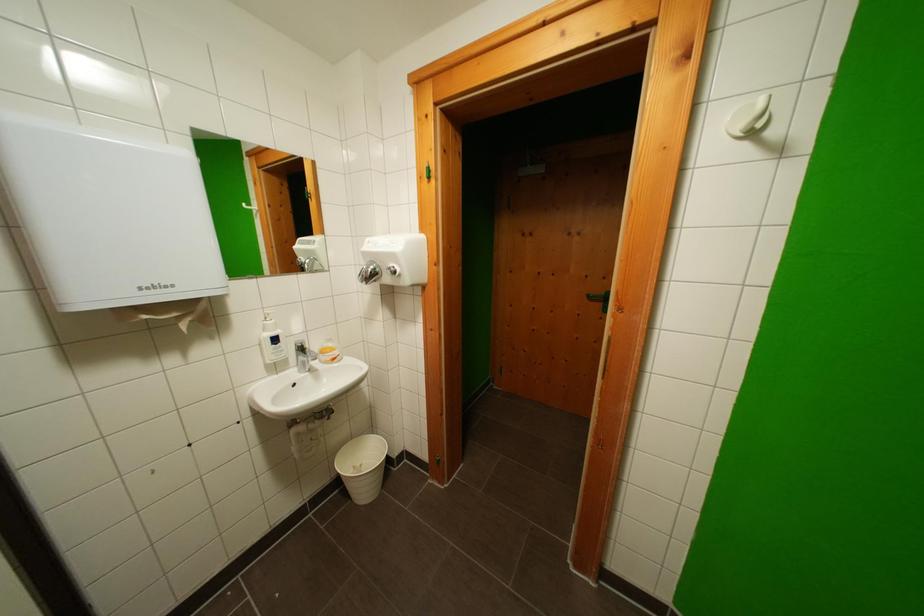
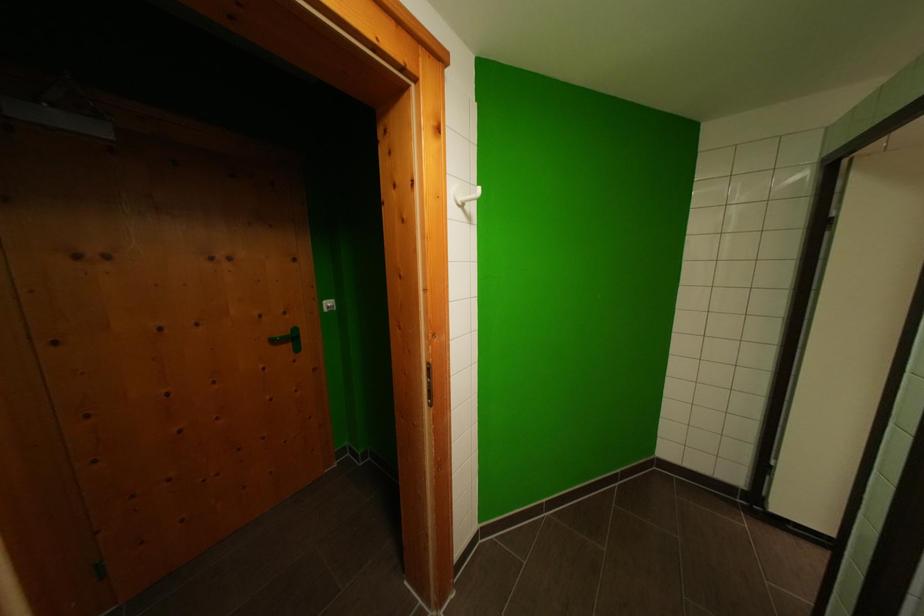
Question: The images are taken continuously from a first-person perspective. In which direction is your viewpoint rotating?

Choices:
 (A) Left
 (B) Right
 (C) Up
 (D) Down

Answer: (B)